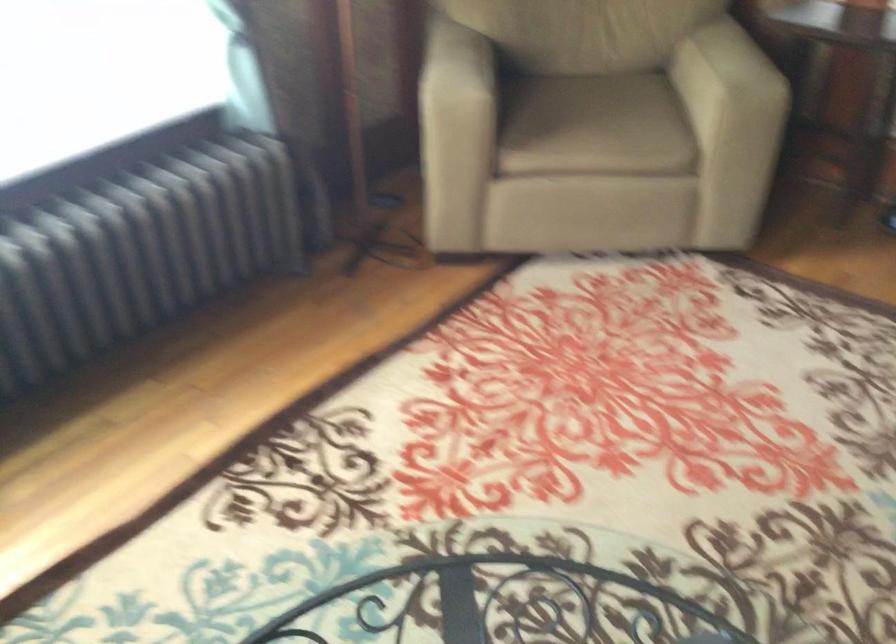
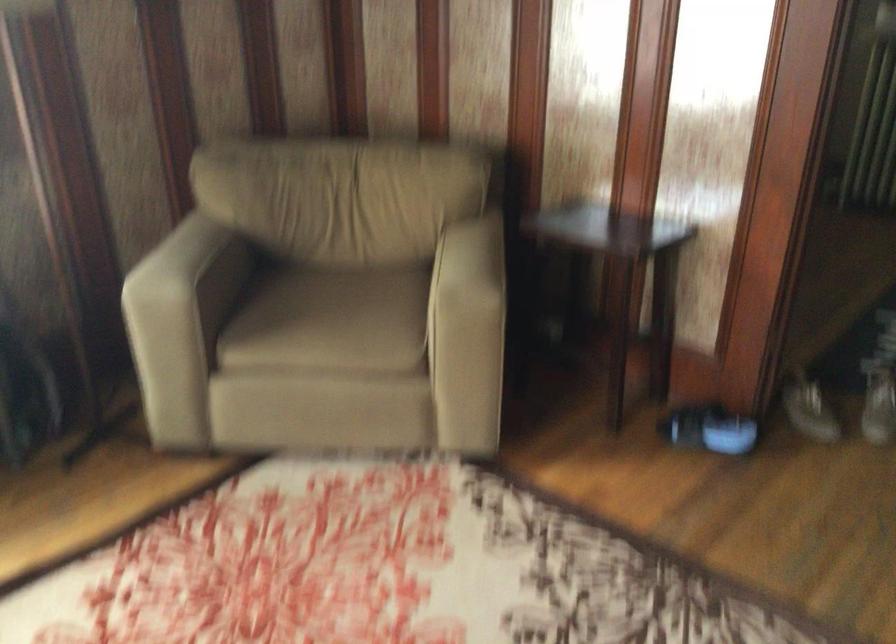
In the second image, find the point that corresponds to [593,122] in the first image.

(331, 321)